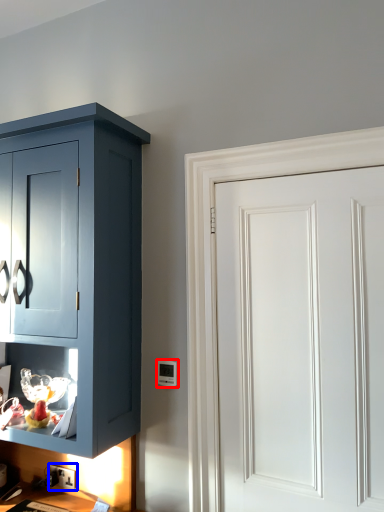
Question: Which object appears farthest to the camera in this image, light switch (highlighted by a red box) or electric outlet (highlighted by a blue box)?

Choices:
 (A) light switch
 (B) electric outlet

Answer: (B)